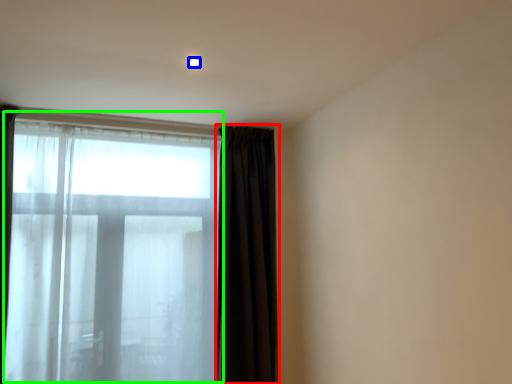
Question: Considering the real-world distances, which object is farthest from curtain (highlighted by a red box)? light (highlighted by a blue box) or bay window (highlighted by a green box)?

Choices:
 (A) light
 (B) bay window

Answer: (A)